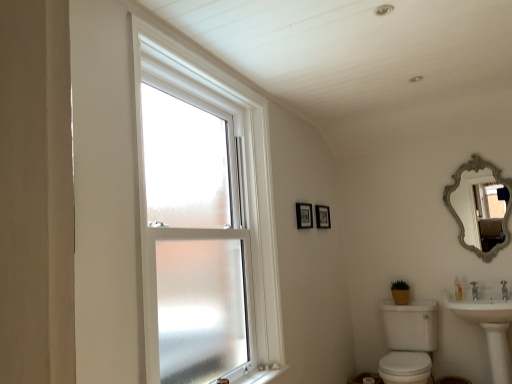
Question: Should I look upward or downward to see matte black picture frame at upper center, which ranks as the 2th picture frame in back-to-front order?

Choices:
 (A) up
 (B) down

Answer: (B)

Question: From a real-world perspective, is white plastic window sill at lower center located higher than silver/gilded ornate mirror at upper right?

Choices:
 (A) no
 (B) yes

Answer: (A)

Question: Is white plastic window sill at lower center at the right side of silver/gilded ornate mirror at upper right?

Choices:
 (A) yes
 (B) no

Answer: (B)

Question: Is white plastic window sill at lower center thinner than silver/gilded ornate mirror at upper right?

Choices:
 (A) yes
 (B) no

Answer: (B)

Question: From a real-world perspective, is white plastic window sill at lower center beneath silver/gilded ornate mirror at upper right?

Choices:
 (A) yes
 (B) no

Answer: (A)

Question: Would you say silver/gilded ornate mirror at upper right is part of white plastic window sill at lower center's contents?

Choices:
 (A) no
 (B) yes

Answer: (A)

Question: Is white plastic window sill at lower center taller than silver/gilded ornate mirror at upper right?

Choices:
 (A) yes
 (B) no

Answer: (B)

Question: Considering the relative sizes of white plastic window sill at lower center and white glossy sink at lower right, the 1th sink viewed from the right, in the image provided, is white plastic window sill at lower center shorter than white glossy sink at lower right, the 1th sink viewed from the right,?

Choices:
 (A) yes
 (B) no

Answer: (A)

Question: Is white plastic window sill at lower center closer to camera compared to white glossy sink at lower right, the 1th sink viewed from the right?

Choices:
 (A) no
 (B) yes

Answer: (B)

Question: From the image's perspective, is white plastic window sill at lower center located above white glossy sink at lower right, the second sink positioned from the left?

Choices:
 (A) no
 (B) yes

Answer: (B)

Question: Is white plastic window sill at lower center beside white glossy sink at lower right, the 1th sink viewed from the right?

Choices:
 (A) no
 (B) yes

Answer: (A)

Question: Could white glossy sink at lower right, the 1th sink viewed from the right, be considered to be inside white plastic window sill at lower center?

Choices:
 (A) yes
 (B) no

Answer: (B)

Question: Is white plastic window sill at lower center further to the viewer compared to white glossy sink at lower right, the 1th sink viewed from the right?

Choices:
 (A) no
 (B) yes

Answer: (A)

Question: Considering the relative sizes of white glossy sink at lower right, the second sink positioned from the left, and wooden picture frame at upper center, placed as the second picture frame when sorted from front to back, in the image provided, is white glossy sink at lower right, the second sink positioned from the left, smaller than wooden picture frame at upper center, placed as the second picture frame when sorted from front to back,?

Choices:
 (A) no
 (B) yes

Answer: (A)